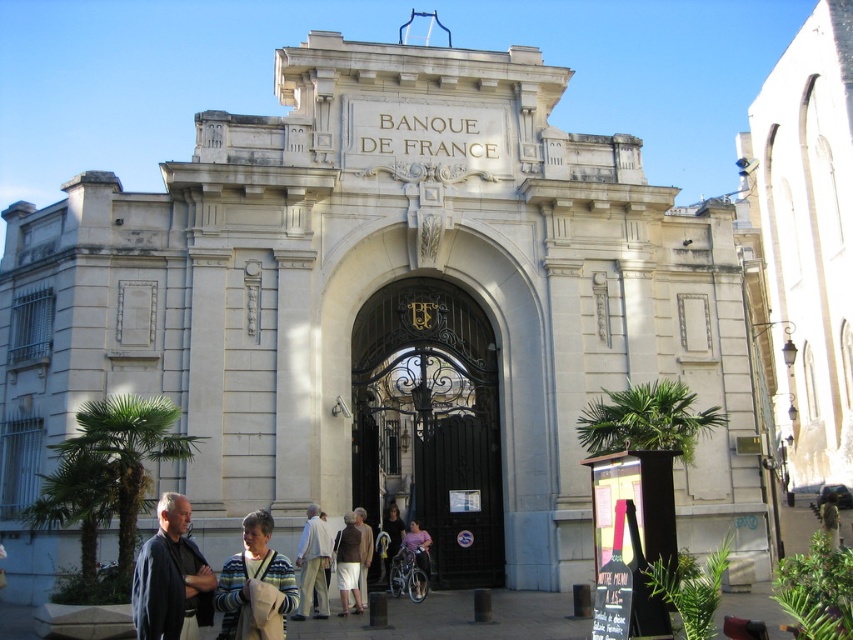
The width and height of the screenshot is (853, 640). Find the location of `striped sweater at center`. striped sweater at center is located at coordinates (254, 582).

Which is in front, point (279, 573) or point (349, 566)?

Point (279, 573) is more forward.

Is point (253, 536) more distant than point (335, 545)?

No, (253, 536) is in front of (335, 545).

Find the location of a particular element. This screenshot has height=640, width=853. striped sweater at center is located at coordinates [254, 582].

Is dark wrought iron gate at center to the left of light pink fabric at center from the viewer's perspective?

No, dark wrought iron gate at center is not to the left of light pink fabric at center.

Consider the image. Does dark wrought iron gate at center have a greater width compared to light pink fabric at center?

Indeed, dark wrought iron gate at center has a greater width compared to light pink fabric at center.

The image size is (853, 640). Find the location of `dark wrought iron gate at center`. dark wrought iron gate at center is located at coordinates (430, 422).

Which is below, dark blue jacket at lower left or striped sweater at center?

striped sweater at center is lower down.

Is point (161, 593) closer to viewer compared to point (222, 608)?

Yes, point (161, 593) is in front of point (222, 608).

Find the location of `dark blue jacket at lower left`. dark blue jacket at lower left is located at coordinates (170, 576).